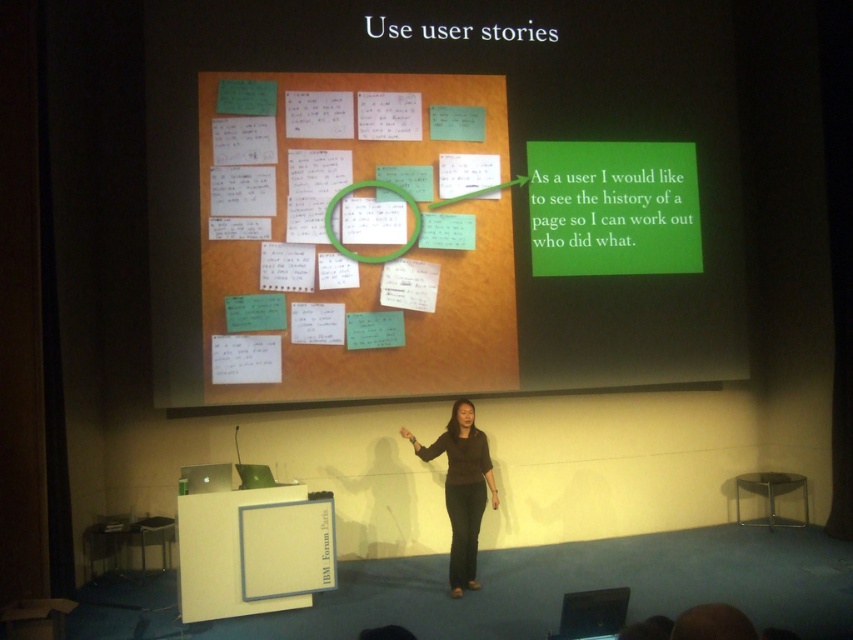
In the scene shown: You are an attendee at the presentation and you want to focus on the green paper notes at center. However, the green plastic magnifying glass at upper center is blocking your view. Can you move the magnifying glass to the side so you can see the notes better?

Result: The green paper notes at center are in front of the green plastic magnifying glass at upper center, meaning the magnifying glass is behind the notes and not blocking the view. Therefore, you don not need to move the magnifying glass to see the notes better.

You are an audience member sitting in the front row of the presentation. You notice two points on the projection screen at coordinates point (276, 109) and point (334, 205). Which point is closer to you?

Point (276, 109) is in front of point (334, 205), so it is closer to you.